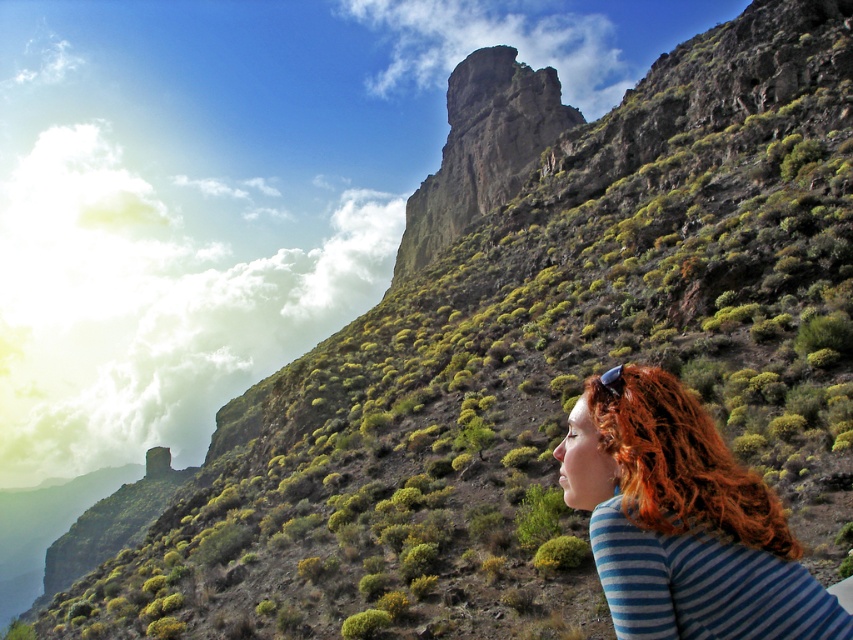
You are a photographer standing at the edge of the cliff. You want to capture a wide shot that includes both the blonde hair at lower right and the rusty stone cliff at center. Which object should you frame first to ensure both fit in the shot?

Since the blonde hair at lower right has a lesser width compared to the rusty stone cliff at center, you should frame the wider rusty stone cliff at center first to ensure both objects fit in the shot.

Based on the photo, you are a photographer standing at the edge of the cliff. You want to capture a photo that includes both the blonde hair at lower right and the rusty stone cliff at center. Which object will appear smaller in the final photo?

The blonde hair at lower right will appear smaller in the final photo because it is shorter than the rusty stone cliff at center.